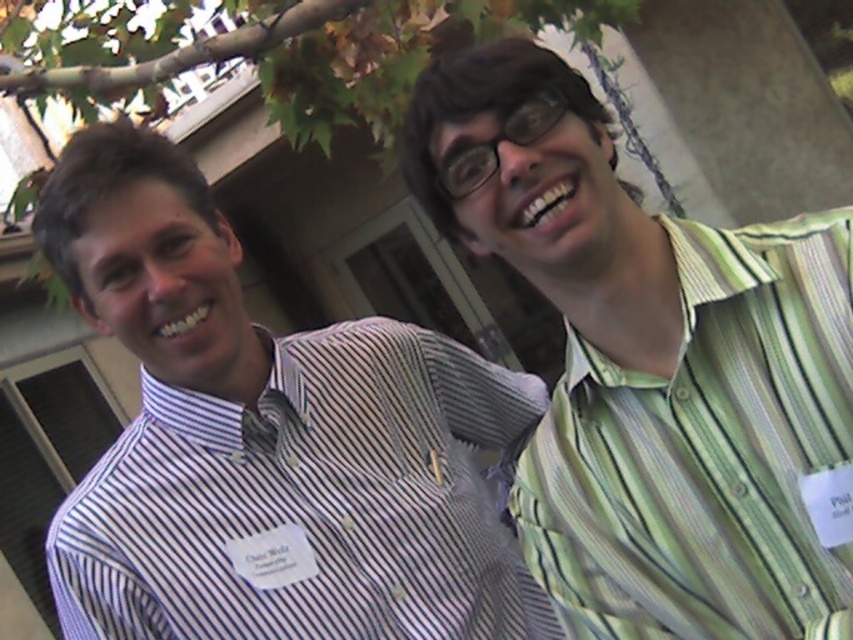
Question: Which point is closer to the camera taking this photo?

Choices:
 (A) (250, 595)
 (B) (772, 244)

Answer: (B)

Question: Is green striped shirt at right bigger than white striped shirt at left?

Choices:
 (A) no
 (B) yes

Answer: (A)

Question: Considering the relative positions of green striped shirt at right and white striped shirt at left in the image provided, where is green striped shirt at right located with respect to white striped shirt at left?

Choices:
 (A) left
 (B) right

Answer: (B)

Question: Can you confirm if green striped shirt at right is positioned below white striped shirt at left?

Choices:
 (A) yes
 (B) no

Answer: (B)